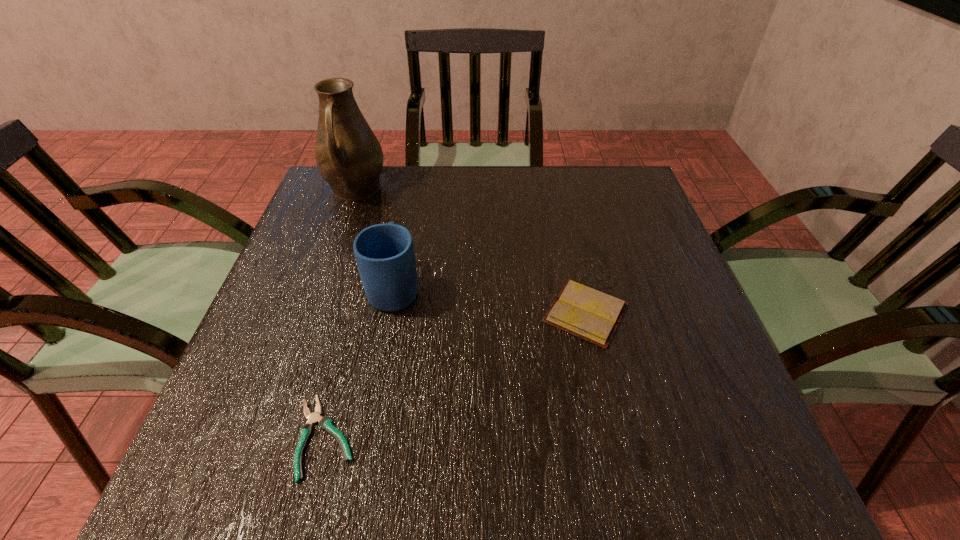
I want to click on vacant area between the pliers and the diary, so click(456, 375).

At what (x,y) coordinates should I click in order to perform the action: click on vacant region between the rightmost object and the pitcher. Please return your answer as a coordinate pair (x, y). Image resolution: width=960 pixels, height=540 pixels. Looking at the image, I should click on (470, 252).

Find the location of a particular element. The height and width of the screenshot is (540, 960). free space between the shortest object and the diary is located at coordinates (456, 375).

Find the location of a particular element. unoccupied area between the nearest object and the mug is located at coordinates (360, 362).

Find the location of a particular element. vacant space that's between the diary and the mug is located at coordinates (491, 300).

This screenshot has width=960, height=540. I want to click on the second closest object relative to the tallest object, so click(582, 311).

This screenshot has width=960, height=540. I want to click on the third closest object relative to the rightmost object, so click(349, 157).

Locate an element on the screen. The width and height of the screenshot is (960, 540). free point that satisfies the following two spatial constraints: 1. on the handle side of the nearest object; 2. on the left side of the tallest object is located at coordinates (269, 437).

Image resolution: width=960 pixels, height=540 pixels. What are the coordinates of `vacant region that satisfies the following two spatial constraints: 1. on the handle side of the farthest object; 2. on the right side of the rightmost object` in the screenshot? It's located at (312, 313).

Identify the location of blank area in the image that satisfies the following two spatial constraints: 1. on the handle side of the diary; 2. on the right side of the farthest object. The image size is (960, 540). (312, 313).